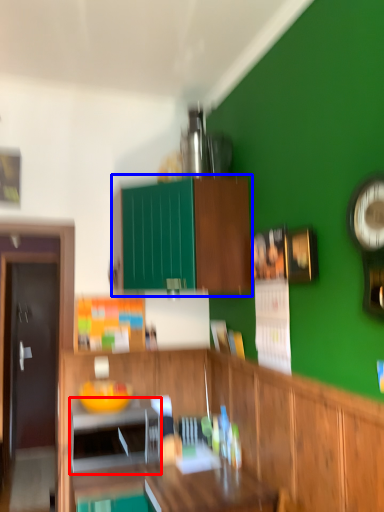
Question: Which object is further to the camera taking this photo, appliance (highlighted by a red box) or cabinetry (highlighted by a blue box)?

Choices:
 (A) appliance
 (B) cabinetry

Answer: (A)